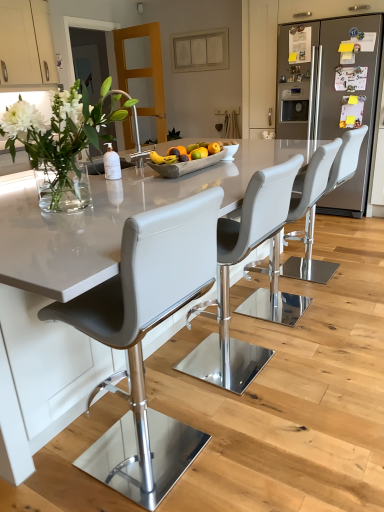
What are the coordinates of `free space in front of white leather bar stool at center, the second chair in the front-to-back sequence` in the screenshot? It's located at (258, 422).